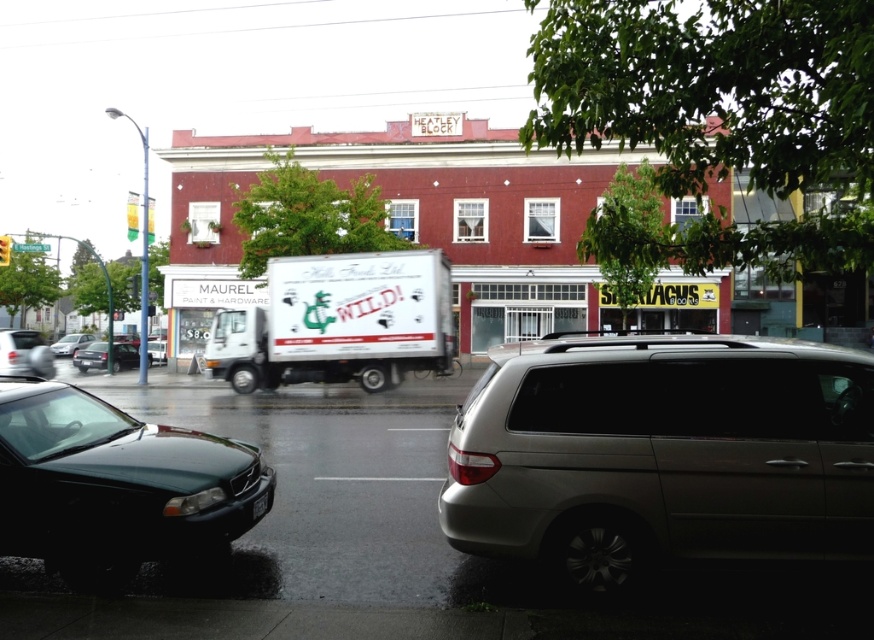
Question: Can you confirm if shiny dark green sedan at lower left is bigger than metallic silver sedan at center?

Choices:
 (A) yes
 (B) no

Answer: (B)

Question: Is shiny dark green sedan at lower left wider than white matte truck at center?

Choices:
 (A) yes
 (B) no

Answer: (A)

Question: Which object is farther from the camera taking this photo?

Choices:
 (A) shiny black sedan at left
 (B) silver metallic minivan at lower right
 (C) white matte truck at center
 (D) matte black sedan at left

Answer: (D)

Question: Which point is farther from the camera taking this photo?

Choices:
 (A) (267, 500)
 (B) (85, 355)
 (C) (59, 339)
 (D) (432, 358)

Answer: (C)

Question: Which point is farther to the camera?

Choices:
 (A) shiny black sedan at left
 (B) black plastic license plate at lower center
 (C) silver metallic minivan at lower right
 (D) metallic silver sedan at center

Answer: (D)

Question: Can you confirm if metallic silver sedan at lower left is wider than black plastic license plate at lower center?

Choices:
 (A) yes
 (B) no

Answer: (A)